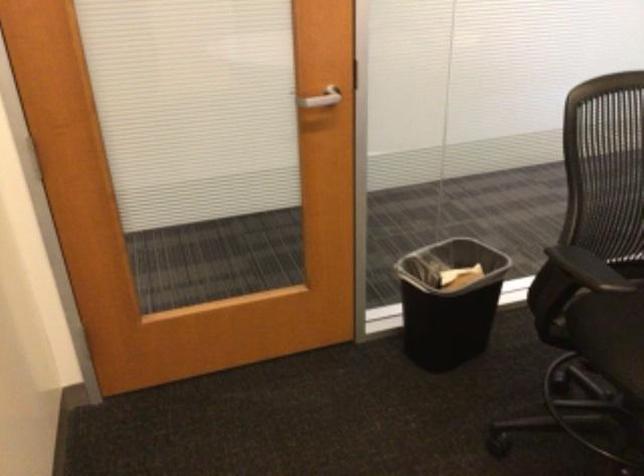
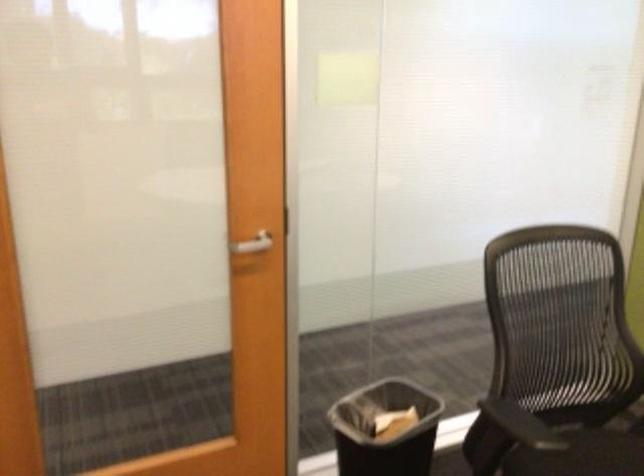
Question: In a continuous first-person perspective shot, in which direction is the camera moving?

Choices:
 (A) Left
 (B) Right
 (C) Forward
 (D) Backward

Answer: (B)